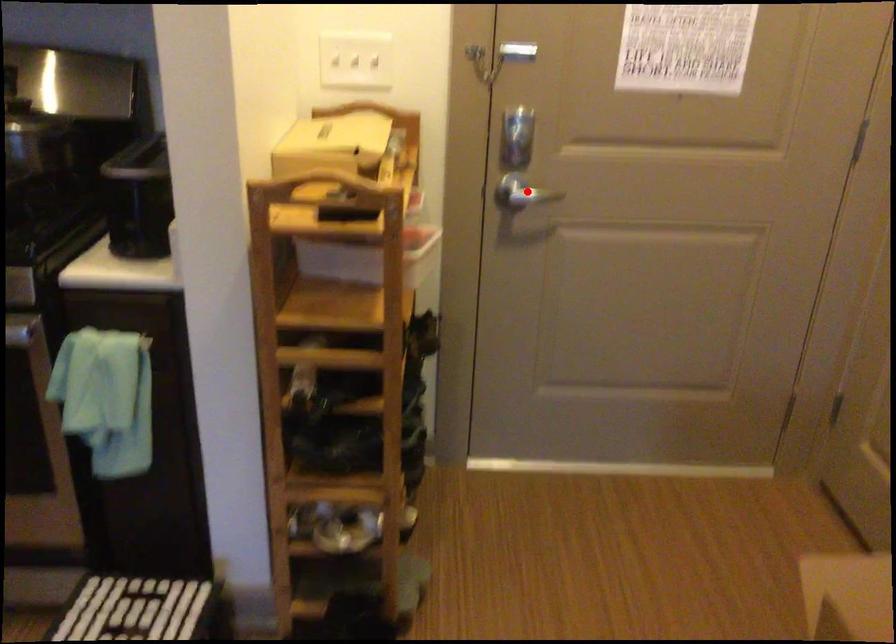
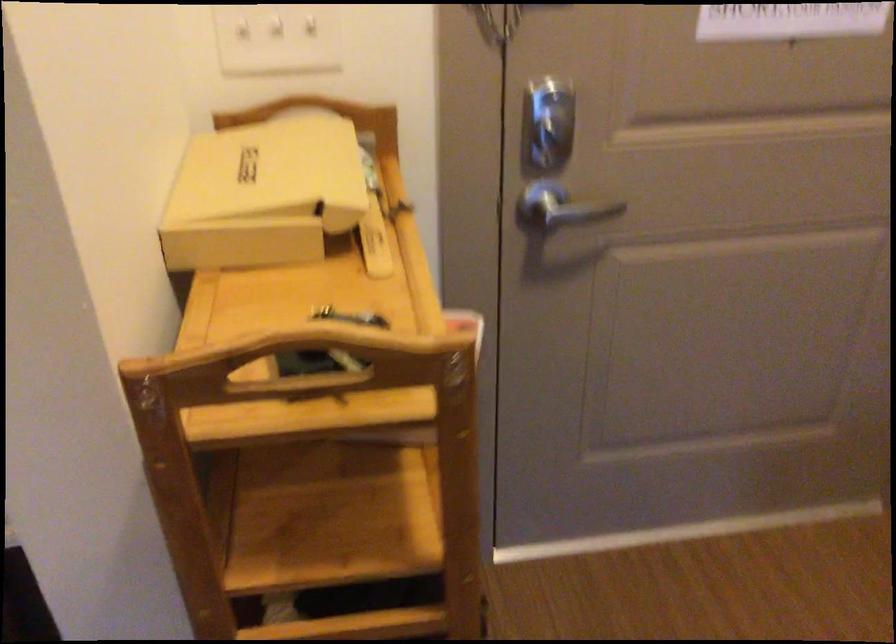
Question: I am providing you with two images of the same scene from different viewpoints. In image1, a red point is highlighted. Considering the same 3D point in image2, which of the following is correct?

Choices:
 (A) It is closer
 (B) It is farther

Answer: (A)